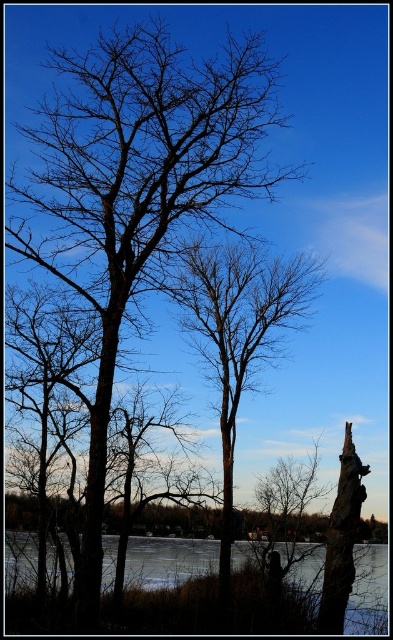
This screenshot has width=393, height=640. What do you see at coordinates (168, 561) in the screenshot?
I see `frozen ice at lower center` at bounding box center [168, 561].

Does frozen ice at lower center appear on the right side of smooth bark tree trunk at right?

No, frozen ice at lower center is not to the right of smooth bark tree trunk at right.

Where is `frozen ice at lower center`? The height and width of the screenshot is (640, 393). frozen ice at lower center is located at coordinates (168, 561).

At what (x,y) coordinates should I click in order to perform the action: click on frozen ice at lower center. Please return your answer as a coordinate pair (x, y). The width and height of the screenshot is (393, 640). Looking at the image, I should click on pos(168,561).

Is point (187, 269) farther from viewer compared to point (354, 492)?

Yes, it is.

Does brown rough bark tree at center appear over smooth bark tree trunk at right?

Correct, brown rough bark tree at center is located above smooth bark tree trunk at right.

The width and height of the screenshot is (393, 640). Identify the location of brown rough bark tree at center. (238, 330).

Which is below, brown rough bark tree at center or frozen ice at lower center?

frozen ice at lower center is lower down.

Which is in front, point (222, 484) or point (130, 563)?

Point (222, 484)

I want to click on brown rough bark tree at center, so click(x=238, y=330).